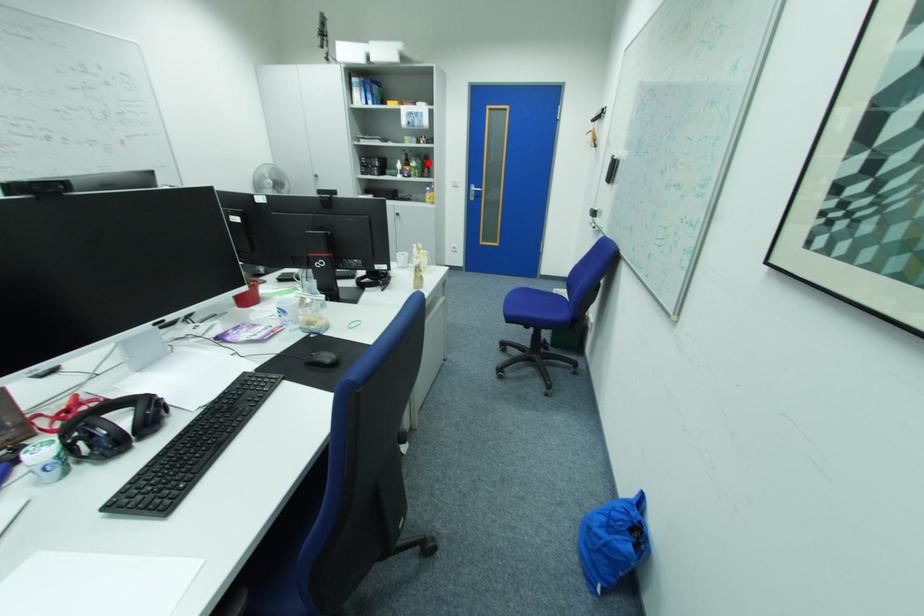
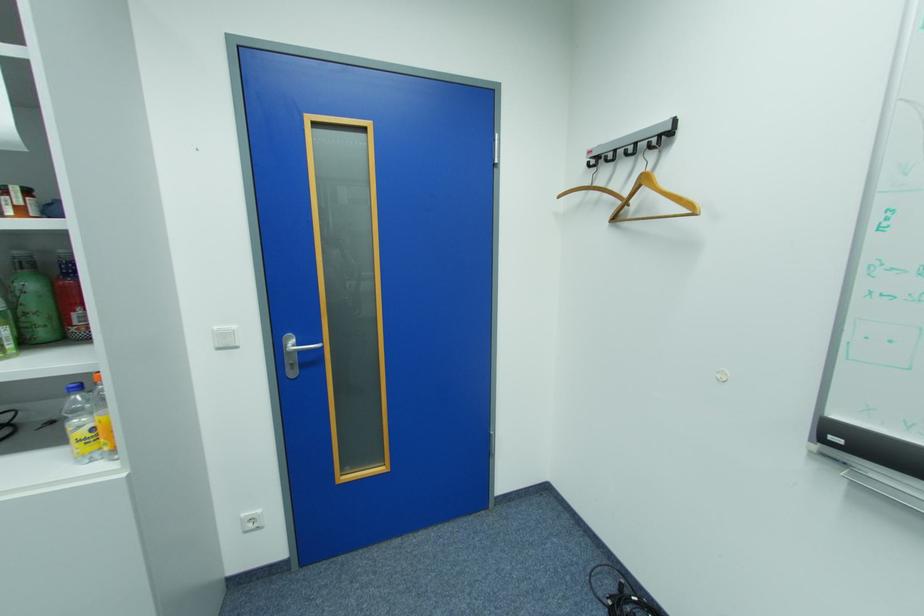
The point at the highlighted location is marked in the first image. Where is the corresponding point in the second image?

(41, 286)